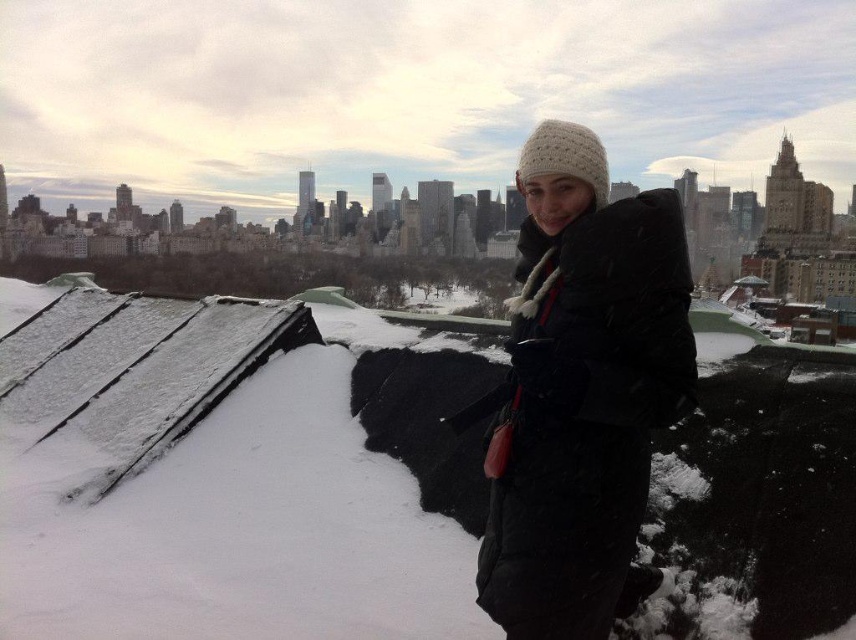
You are a drone operator trying to capture a photo of the white fluffy snow at center and the matte black coat at center from above. The drone has a camera with a 100 meter range. Can the drone capture both objects in one photo if they are 50.05 meters apart?

The white fluffy snow at center and the matte black coat at center are 50.05 meters apart. Since the drone camera has a 100 meter range, it can easily capture both objects within its range as 50.05 meters is less than 100 meters.

You are a photographer trying to capture a shot of the city skyline from the rooftop. You want to position yourself so that the white fluffy snow at center and the matte black coat at center are both visible in the frame. Which object should you place closer to the left side of your camera viewfinder to ensure both are in the shot?

To ensure both the white fluffy snow at center and the matte black coat at center are visible in the shot, you should position the white fluffy snow at center closer to the left side of the camera viewfinder since it is already located to the left of the matte black coat at center in the scene.